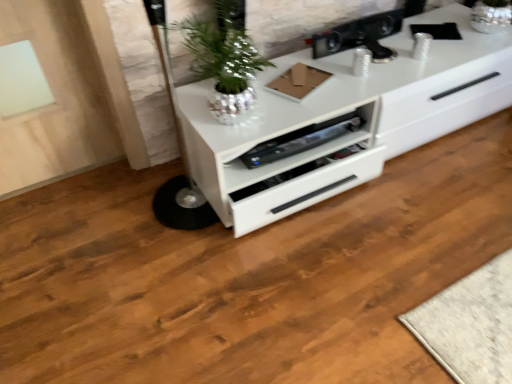
Identify the location of free space in front of metallic black speaker at upper center, the second appliance when ordered from bottom to top. The height and width of the screenshot is (384, 512). (367, 76).